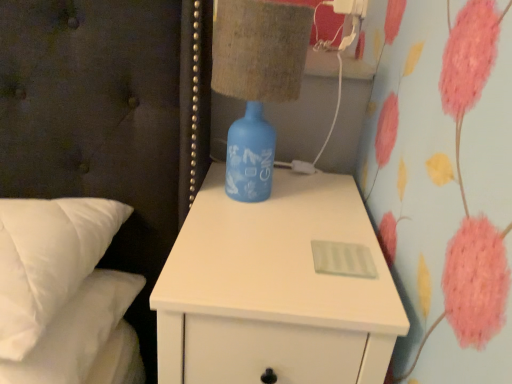
This screenshot has height=384, width=512. I want to click on vacant space to the right of blue glass bottle at upper right, so click(x=329, y=196).